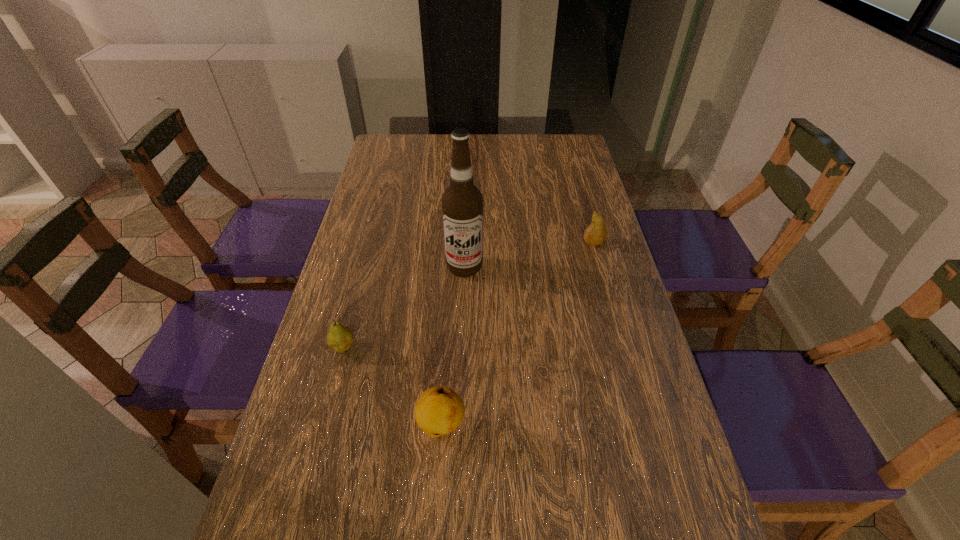
Where is `object that ranks as the third closest to the rightmost object`? object that ranks as the third closest to the rightmost object is located at coordinates (340, 338).

Locate an element on the screen. pear object that ranks as the closest to the second pear from right to left is located at coordinates (340, 338).

The width and height of the screenshot is (960, 540). What are the coordinates of `pear that is the third closest to the third nearest object` in the screenshot? It's located at (439, 410).

Find the location of `vacant region that satisfies the following two spatial constraints: 1. on the back side of the leftmost object; 2. on the right side of the farthest pear`. vacant region that satisfies the following two spatial constraints: 1. on the back side of the leftmost object; 2. on the right side of the farthest pear is located at coordinates (371, 243).

Identify the location of free space that satisfies the following two spatial constraints: 1. on the back side of the farthest pear; 2. on the left side of the leftmost pear. (371, 243).